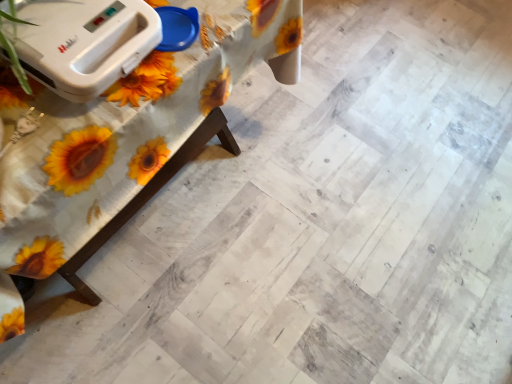
This screenshot has width=512, height=384. What are the coordinates of `white wood table at upper left` in the screenshot? It's located at (x=128, y=138).

What do you see at coordinates (128, 138) in the screenshot? I see `white wood table at upper left` at bounding box center [128, 138].

The image size is (512, 384). In order to click on white plastic toaster at upper left in this screenshot , I will do `click(84, 43)`.

The height and width of the screenshot is (384, 512). Describe the element at coordinates (84, 43) in the screenshot. I see `white plastic toaster at upper left` at that location.

Measure the distance between white plastic toaster at upper left and camera.

white plastic toaster at upper left and camera are 26.73 inches apart.

Locate an element on the screen. Image resolution: width=512 pixels, height=384 pixels. white wood table at upper left is located at coordinates (128, 138).

Does white plastic toaster at upper left appear on the right side of white wood table at upper left?

Yes.

Between white plastic toaster at upper left and white wood table at upper left, which one is positioned in front?

Positioned in front is white wood table at upper left.

Between point (53, 67) and point (146, 133), which one is positioned behind?

The point (146, 133) is more distant.

From the image's perspective, is white plastic toaster at upper left below white wood table at upper left?

Incorrect, from the image's perspective, white plastic toaster at upper left is higher than white wood table at upper left.

From a real-world perspective, which object stands above the other?

white plastic toaster at upper left.

From the picture: Does white plastic toaster at upper left have a greater width compared to white wood table at upper left?

In fact, white plastic toaster at upper left might be narrower than white wood table at upper left.

Can you confirm if white plastic toaster at upper left is shorter than white wood table at upper left?

Yes, white plastic toaster at upper left is shorter than white wood table at upper left.

From the picture: Between white plastic toaster at upper left and white wood table at upper left, which one has larger size?

white wood table at upper left.

Would you say white plastic toaster at upper left contains white wood table at upper left?

That's incorrect, white wood table at upper left is not inside white plastic toaster at upper left.

Would you consider white plastic toaster at upper left to be distant from white wood table at upper left?

white plastic toaster at upper left is near white wood table at upper left, not far away.

In the scene shown: Could you tell me if white plastic toaster at upper left is facing white wood table at upper left?

No, white plastic toaster at upper left is not aimed at white wood table at upper left.

How different are the orientations of white plastic toaster at upper left and white wood table at upper left in degrees?

The angle between the facing direction of white plastic toaster at upper left and the facing direction of white wood table at upper left is 3.84 degrees.

Image resolution: width=512 pixels, height=384 pixels. Identify the location of table on the left of white plastic toaster at upper left. (128, 138).

Which object is positioned more to the right, white wood table at upper left or white plastic toaster at upper left?

Positioned to the right is white plastic toaster at upper left.

Which is in front, white wood table at upper left or white plastic toaster at upper left?

white wood table at upper left is more forward.

Considering the positions of points (212, 135) and (65, 38), is point (212, 135) closer to camera compared to point (65, 38)?

No, it is behind (65, 38).

From the image's perspective, which one is positioned lower, white wood table at upper left or white plastic toaster at upper left?

white wood table at upper left.

From a real-world perspective, which object rests below the other?

white wood table at upper left.

From the picture: Does white wood table at upper left have a lesser width compared to white plastic toaster at upper left?

No.

In terms of height, does white wood table at upper left look taller or shorter compared to white plastic toaster at upper left?

Considering their sizes, white wood table at upper left has more height than white plastic toaster at upper left.

Can you confirm if white wood table at upper left is bigger than white plastic toaster at upper left?

Yes, white wood table at upper left is bigger than white plastic toaster at upper left.

Can we say white wood table at upper left lies outside white plastic toaster at upper left?

white wood table at upper left is positioned outside white plastic toaster at upper left.

Is the surface of white wood table at upper left in direct contact with white plastic toaster at upper left?

No, white wood table at upper left is not beside white plastic toaster at upper left.

Is white wood table at upper left oriented towards white plastic toaster at upper left?

No, white wood table at upper left is not oriented towards white plastic toaster at upper left.

You are a GUI agent. You are given a task and a screenshot of the screen. Output one action in this format:
    pyautogui.click(x=<x>, y=<y>)
    Task: Click on the table that appears below the white plastic toaster at upper left (from a real-world perspective)
    
    Given the screenshot: What is the action you would take?
    pyautogui.click(x=128, y=138)

The height and width of the screenshot is (384, 512). Identify the location of appliance that appears behind the white wood table at upper left. (84, 43).

At what (x,y) coordinates should I click in order to perform the action: click on table below the white plastic toaster at upper left (from the image's perspective). Please return your answer as a coordinate pair (x, y). The image size is (512, 384). Looking at the image, I should click on (128, 138).